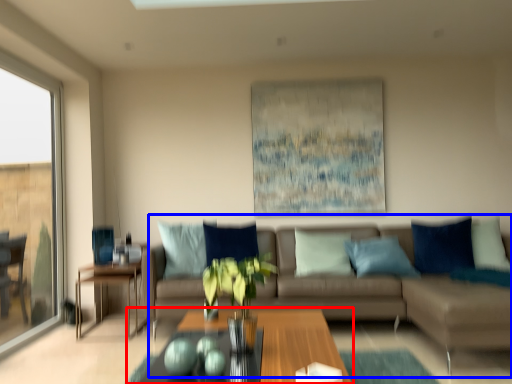
Question: Which object is further to the camera taking this photo, coffee table (highlighted by a red box) or studio couch (highlighted by a blue box)?

Choices:
 (A) coffee table
 (B) studio couch

Answer: (B)